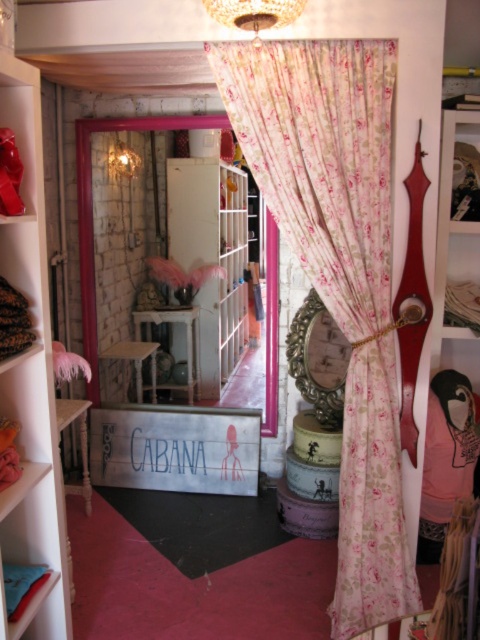
Question: Among these objects, which one is farthest from the camera?

Choices:
 (A) crystal glass chandelier at upper center
 (B) floral fabric curtain at center

Answer: (B)

Question: Can you confirm if white wood shelf at left is positioned to the left of crystal glass chandelier at upper center?

Choices:
 (A) yes
 (B) no

Answer: (A)

Question: Among these objects, which one is farthest from the camera?

Choices:
 (A) floral fabric curtain at center
 (B) white wood shelf at left
 (C) crystal glass chandelier at upper center

Answer: (A)

Question: Can you confirm if white wood shelf at left is positioned above crystal glass chandelier at upper center?

Choices:
 (A) no
 (B) yes

Answer: (A)

Question: Does floral fabric curtain at center appear on the right side of crystal glass chandelier at upper center?

Choices:
 (A) no
 (B) yes

Answer: (B)

Question: Which point is farther to the camera?

Choices:
 (A) coord(227,54)
 (B) coord(49,531)
 (C) coord(267,8)

Answer: (B)